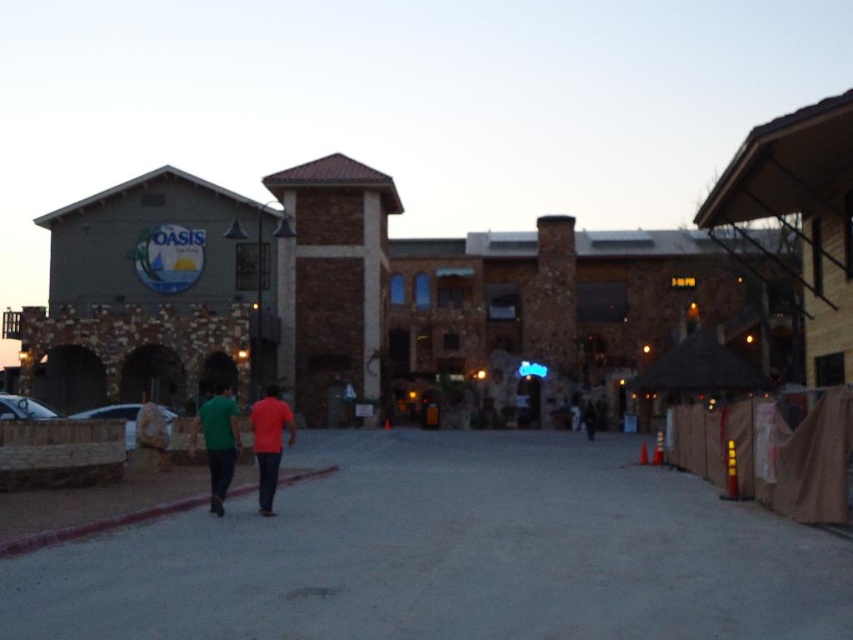
You are standing at the point labeled point [260,420] and want to walk towards the building entrance. Is the point labeled point [634,628] in your path?

Yes, the point labeled point [634,628] is in front of point [260,420], so it is in your path towards the building entrance.

You are standing at the entrance of the OASIS building and see the green matte shirt at center and the dark blue jeans at center. Which one is taller?

The green matte shirt at center is taller than the dark blue jeans at center.